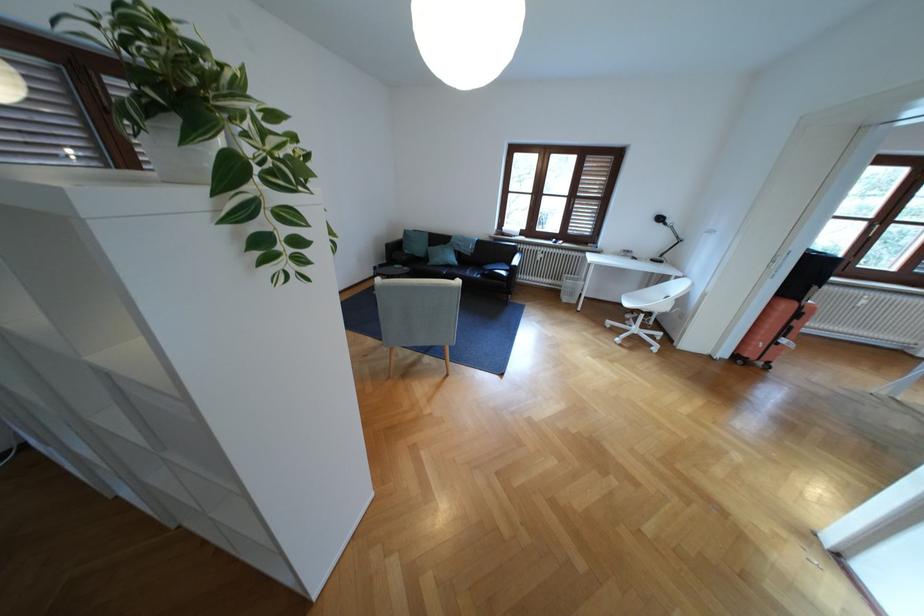
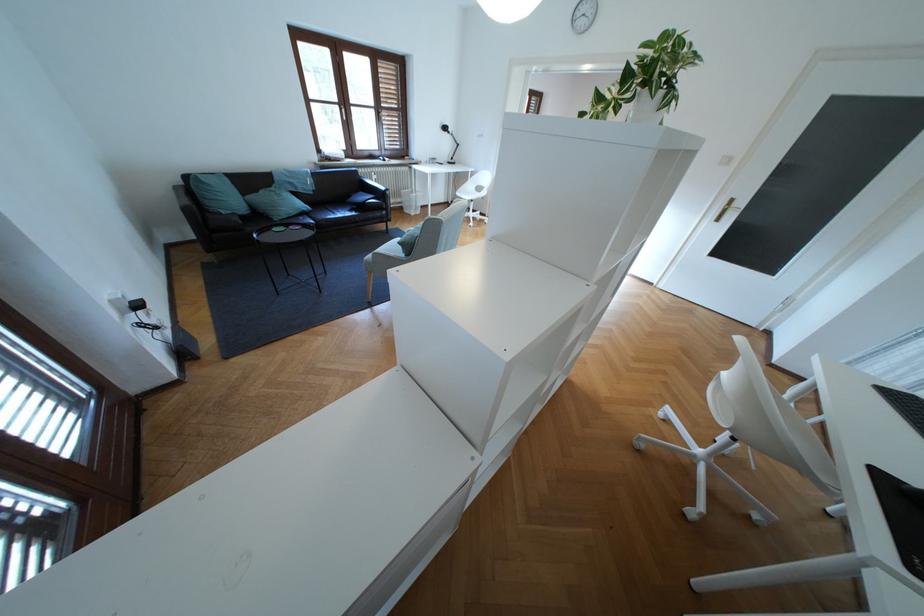
The point at (440, 246) is marked in the first image. Where is the corresponding point in the second image?

(253, 193)